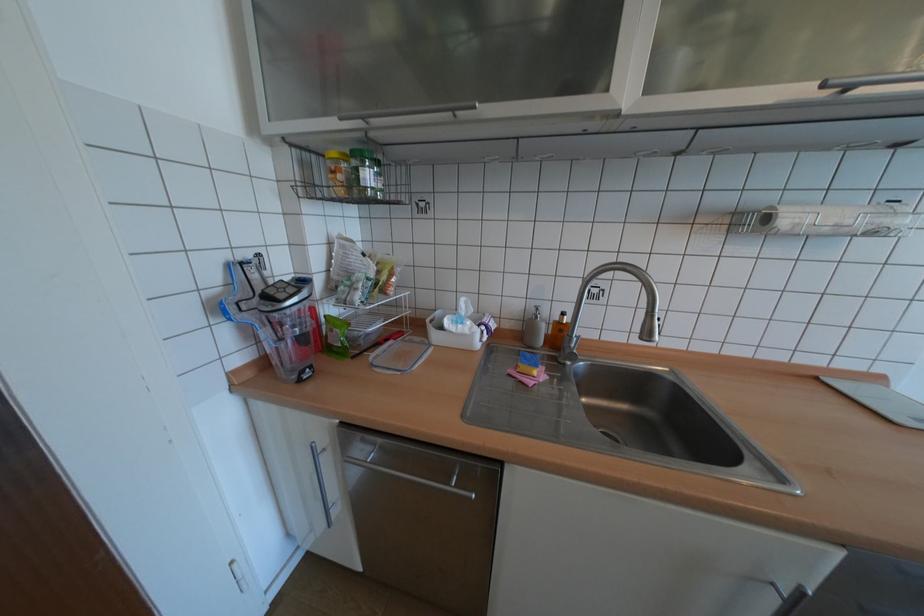
Where would you push the grey dispenser pump? Please return your answer as a coordinate pair (x, y).

(536, 310)